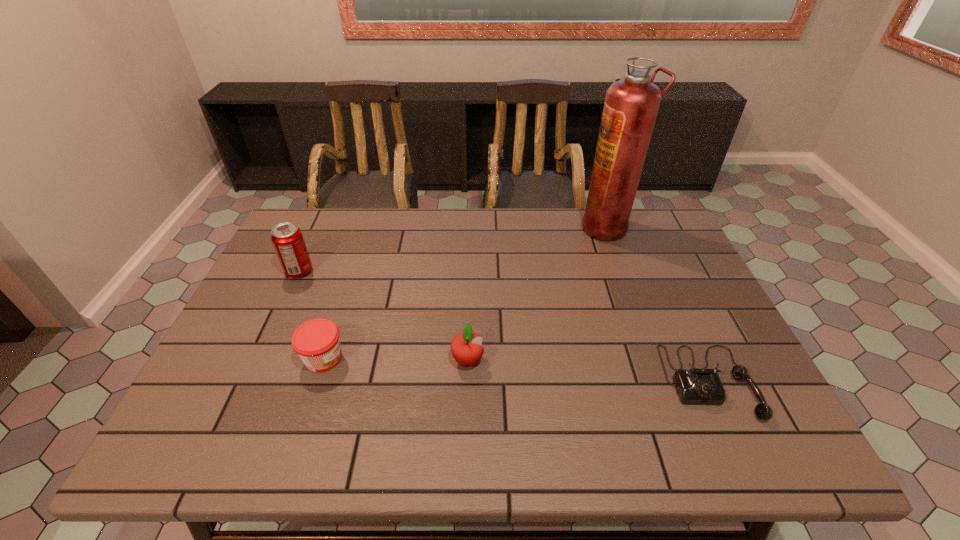
Where is `vacant region at the far edge of the desktop`? vacant region at the far edge of the desktop is located at coordinates (552, 217).

The height and width of the screenshot is (540, 960). I want to click on vacant space at the near edge, so click(x=602, y=446).

In order to click on vacant space at the left edge of the desktop in this screenshot , I will do `click(272, 284)`.

Find the location of a particular element. This screenshot has width=960, height=540. free spot at the right edge of the desktop is located at coordinates point(737,384).

You are a GUI agent. You are given a task and a screenshot of the screen. Output one action in this format:
    pyautogui.click(x=<x>, y=<y>)
    Task: Click on the vacant region at the far right corner of the desktop
    
    Given the screenshot: What is the action you would take?
    pyautogui.click(x=642, y=247)

You are a GUI agent. You are given a task and a screenshot of the screen. Output one action in this format:
    pyautogui.click(x=<x>, y=<y>)
    Task: Click on the free region at the near right corner of the desktop
    Image resolution: width=960 pixels, height=540 pixels.
    Given the screenshot: What is the action you would take?
    pyautogui.click(x=757, y=446)

Find the location of a particular element. The height and width of the screenshot is (540, 960). unoccupied position between the soda can and the jam is located at coordinates (311, 315).

Image resolution: width=960 pixels, height=540 pixels. What are the coordinates of `free space that is in between the telephone and the fourth object from right to left` in the screenshot? It's located at (516, 370).

Where is `free space between the jam and the third object from left to right`? The height and width of the screenshot is (540, 960). free space between the jam and the third object from left to right is located at coordinates (396, 359).

This screenshot has width=960, height=540. I want to click on unoccupied area between the tallest object and the third object from right to left, so click(537, 294).